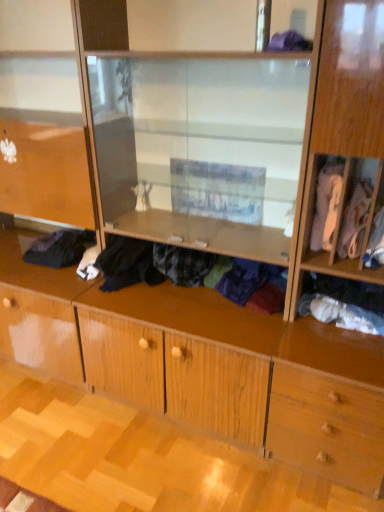
Locate an element on the screen. white fabric at right, which ranks as the fourth clothing in left-to-right order is located at coordinates (326, 205).

The image size is (384, 512). What do you see at coordinates (341, 314) in the screenshot?
I see `white fabric at lower right, which appears as the 2th clothing when viewed from the right` at bounding box center [341, 314].

In order to face purple fabric at upper center, the 5th clothing positioned from the right, should I rotate leftwards or rightwards?

To align with it, rotate right about 13.618°.

The width and height of the screenshot is (384, 512). In order to click on dark blue fabric at center, the second clothing in the left-to-right sequence in this screenshot , I will do `click(151, 264)`.

This screenshot has width=384, height=512. What do you see at coordinates (151, 264) in the screenshot?
I see `dark blue fabric at center, marked as the sixth clothing in a right-to-left arrangement` at bounding box center [151, 264].

What are the coordinates of `black fabric at lower left, positioned as the 7th clothing in right-to-left order` in the screenshot? It's located at (60, 248).

Is white fabric at lower right, which is counted as the 6th clothing, starting from the left, to the left or to the right of dark blue fabric at center, marked as the sixth clothing in a right-to-left arrangement, in the image?

Clearly, white fabric at lower right, which is counted as the 6th clothing, starting from the left, is on the right of dark blue fabric at center, marked as the sixth clothing in a right-to-left arrangement, in the image.

Where is `the 2nd clothing located above the white fabric at lower right, which appears as the 2th clothing when viewed from the right (from a real-world perspective)`? This screenshot has width=384, height=512. the 2nd clothing located above the white fabric at lower right, which appears as the 2th clothing when viewed from the right (from a real-world perspective) is located at coordinates (151, 264).

Considering the sizes of objects white fabric at lower right, which appears as the 2th clothing when viewed from the right, and dark blue fabric at center, marked as the sixth clothing in a right-to-left arrangement, in the image provided, who is smaller, white fabric at lower right, which appears as the 2th clothing when viewed from the right, or dark blue fabric at center, marked as the sixth clothing in a right-to-left arrangement,?

Smaller between the two is white fabric at lower right, which appears as the 2th clothing when viewed from the right.

From the image's perspective, is white fabric at lower right, which appears as the 2th clothing when viewed from the right, above or below dark blue fabric at center, marked as the sixth clothing in a right-to-left arrangement?

Clearly, from the image's perspective, white fabric at lower right, which appears as the 2th clothing when viewed from the right, is below dark blue fabric at center, marked as the sixth clothing in a right-to-left arrangement.

From the image's perspective, which one is positioned higher, white fabric at right, acting as the third clothing starting from the right, or black fabric at lower left, which appears as the 1th clothing when viewed from the left?

white fabric at right, acting as the third clothing starting from the right, from the image's perspective.

Is white fabric at right, acting as the third clothing starting from the right, thinner than black fabric at lower left, positioned as the 7th clothing in right-to-left order?

Correct, the width of white fabric at right, acting as the third clothing starting from the right, is less than that of black fabric at lower left, positioned as the 7th clothing in right-to-left order.

Are white fabric at right, acting as the third clothing starting from the right, and black fabric at lower left, positioned as the 7th clothing in right-to-left order, located far from each other?

That's right, there is a large distance between white fabric at right, acting as the third clothing starting from the right, and black fabric at lower left, positioned as the 7th clothing in right-to-left order.

From the image's perspective, which clothing is the 2nd one below the white fabric at right, which is the fifth clothing from left to right? Please provide its 2D coordinates.

[(60, 248)]

From a real-world perspective, does black fabric at lower left, which appears as the 1th clothing when viewed from the left, sit lower than purple fabric at upper center, which appears as the 3th clothing when viewed from the left?

Indeed, from a real-world perspective, black fabric at lower left, which appears as the 1th clothing when viewed from the left, is positioned beneath purple fabric at upper center, which appears as the 3th clothing when viewed from the left.

Considering the sizes of black fabric at lower left, positioned as the 7th clothing in right-to-left order, and purple fabric at upper center, which appears as the 3th clothing when viewed from the left, in the image, is black fabric at lower left, positioned as the 7th clothing in right-to-left order, taller or shorter than purple fabric at upper center, which appears as the 3th clothing when viewed from the left,?

Clearly, black fabric at lower left, positioned as the 7th clothing in right-to-left order, is taller compared to purple fabric at upper center, which appears as the 3th clothing when viewed from the left.

Looking at this image, is black fabric at lower left, positioned as the 7th clothing in right-to-left order, at the left side of purple fabric at upper center, which appears as the 3th clothing when viewed from the left?

Correct, you'll find black fabric at lower left, positioned as the 7th clothing in right-to-left order, to the left of purple fabric at upper center, which appears as the 3th clothing when viewed from the left.

Can you confirm if black fabric at lower left, positioned as the 7th clothing in right-to-left order, is thinner than purple fabric at upper center, the 5th clothing positioned from the right?

No.

Is dark blue fabric at center, marked as the sixth clothing in a right-to-left arrangement, inside or outside of white fabric at lower right, which is counted as the 6th clothing, starting from the left?

dark blue fabric at center, marked as the sixth clothing in a right-to-left arrangement, is not inside white fabric at lower right, which is counted as the 6th clothing, starting from the left, it's outside.

Is dark blue fabric at center, marked as the sixth clothing in a right-to-left arrangement, thinner than white fabric at lower right, which appears as the 2th clothing when viewed from the right?

Incorrect, the width of dark blue fabric at center, marked as the sixth clothing in a right-to-left arrangement, is not less than that of white fabric at lower right, which appears as the 2th clothing when viewed from the right.

Consider the image. Considering the relative sizes of dark blue fabric at center, marked as the sixth clothing in a right-to-left arrangement, and white fabric at lower right, which appears as the 2th clothing when viewed from the right, in the image provided, is dark blue fabric at center, marked as the sixth clothing in a right-to-left arrangement, shorter than white fabric at lower right, which appears as the 2th clothing when viewed from the right,?

Incorrect, the height of dark blue fabric at center, marked as the sixth clothing in a right-to-left arrangement, does not fall short of that of white fabric at lower right, which appears as the 2th clothing when viewed from the right.

Considering the relative positions of dark blue fabric at center, the second clothing in the left-to-right sequence, and white fabric at lower right, which is counted as the 6th clothing, starting from the left, in the image provided, is dark blue fabric at center, the second clothing in the left-to-right sequence, to the left or to the right of white fabric at lower right, which is counted as the 6th clothing, starting from the left,?

dark blue fabric at center, the second clothing in the left-to-right sequence, is positioned on white fabric at lower right, which is counted as the 6th clothing, starting from the left,'s left side.

Is white fabric at right, which is the fifth clothing from left to right, taller or shorter than white fabric at right, which ranks as the fourth clothing in left-to-right order?

Clearly, white fabric at right, which is the fifth clothing from left to right, is shorter compared to white fabric at right, which ranks as the fourth clothing in left-to-right order.

Is white fabric at right, acting as the third clothing starting from the right, directly adjacent to white fabric at right, which ranks as the fourth clothing in left-to-right order?

Yes.

What's the angular difference between white fabric at right, which is the fifth clothing from left to right, and white fabric at right, the 4th clothing from the right,'s facing directions?

0.000147 degrees.

Would you say white fabric at right, which is the fifth clothing from left to right, contains white fabric at right, the 4th clothing from the right?

No, white fabric at right, the 4th clothing from the right, is located outside of white fabric at right, which is the fifth clothing from left to right.

Who is bigger, dark blue fabric at center, marked as the sixth clothing in a right-to-left arrangement, or purple fabric at upper center, which appears as the 3th clothing when viewed from the left?

Bigger between the two is dark blue fabric at center, marked as the sixth clothing in a right-to-left arrangement.

Measure the distance between dark blue fabric at center, marked as the sixth clothing in a right-to-left arrangement, and purple fabric at upper center, the 5th clothing positioned from the right.

dark blue fabric at center, marked as the sixth clothing in a right-to-left arrangement, and purple fabric at upper center, the 5th clothing positioned from the right, are 38.52 inches apart from each other.

Consider the image. Is dark blue fabric at center, marked as the sixth clothing in a right-to-left arrangement, far away from purple fabric at upper center, the 5th clothing positioned from the right?

No.

Is dark blue fabric at center, the second clothing in the left-to-right sequence, behind purple fabric at upper center, the 5th clothing positioned from the right?

Yes, it is.

Does white fabric at right, which ranks as the fourth clothing in left-to-right order, turn towards dark blue fabric at center, the second clothing in the left-to-right sequence?

No, white fabric at right, which ranks as the fourth clothing in left-to-right order, does not turn towards dark blue fabric at center, the second clothing in the left-to-right sequence.

Does white fabric at right, the 4th clothing from the right, have a smaller size compared to dark blue fabric at center, the second clothing in the left-to-right sequence?

Yes.

Based on the photo, is white fabric at right, which ranks as the fourth clothing in left-to-right order, with dark blue fabric at center, marked as the sixth clothing in a right-to-left arrangement?

Answer: There is a gap between white fabric at right, which ranks as the fourth clothing in left-to-right order, and dark blue fabric at center, marked as the sixth clothing in a right-to-left arrangement.

Which object is wider, white fabric at right, which ranks as the fourth clothing in left-to-right order, or dark blue fabric at center, marked as the sixth clothing in a right-to-left arrangement?

dark blue fabric at center, marked as the sixth clothing in a right-to-left arrangement.

The width and height of the screenshot is (384, 512). In order to click on clothing that is the 4th object to the left of the white fabric at lower right, which appears as the 2th clothing when viewed from the right, starting at the anchor in this screenshot , I will do `click(151, 264)`.

Where is `clothing that is the 3rd one when counting backward from the white fabric at right, which is the fifth clothing from left to right`? The width and height of the screenshot is (384, 512). clothing that is the 3rd one when counting backward from the white fabric at right, which is the fifth clothing from left to right is located at coordinates (60, 248).

From the picture: When comparing their distances from white cotton shirt at right, the first clothing positioned from the right, does black fabric at lower left, positioned as the 7th clothing in right-to-left order, or white fabric at right, the 4th clothing from the right, seem closer?

white fabric at right, the 4th clothing from the right, lies closer to white cotton shirt at right, the first clothing positioned from the right, than the other object.

Considering their positions, is white fabric at right, which is the fifth clothing from left to right, positioned further to dark blue fabric at center, the second clothing in the left-to-right sequence, than white fabric at right, which ranks as the fourth clothing in left-to-right order?

The object further to dark blue fabric at center, the second clothing in the left-to-right sequence, is white fabric at right, which is the fifth clothing from left to right.

Estimate the real-world distances between objects in this image. Which object is further from white cotton shirt at right, the seventh clothing from the left, white fabric at right, which ranks as the fourth clothing in left-to-right order, or white fabric at lower right, which is counted as the 6th clothing, starting from the left?

white fabric at lower right, which is counted as the 6th clothing, starting from the left, lies further to white cotton shirt at right, the seventh clothing from the left, than the other object.

Estimate the real-world distances between objects in this image. Which object is further from purple fabric at upper center, the 5th clothing positioned from the right, white fabric at right, which is the fifth clothing from left to right, or white fabric at right, which ranks as the fourth clothing in left-to-right order?

The object further to purple fabric at upper center, the 5th clothing positioned from the right, is white fabric at right, which is the fifth clothing from left to right.

When comparing their distances from white fabric at lower right, which is counted as the 6th clothing, starting from the left, does purple fabric at upper center, which appears as the 3th clothing when viewed from the left, or white fabric at right, acting as the third clothing starting from the right, seem further?

The object further to white fabric at lower right, which is counted as the 6th clothing, starting from the left, is purple fabric at upper center, which appears as the 3th clothing when viewed from the left.

Looking at the image, which one is located closer to white cotton shirt at right, the seventh clothing from the left, purple fabric at upper center, the 5th clothing positioned from the right, or black fabric at lower left, which appears as the 1th clothing when viewed from the left?

purple fabric at upper center, the 5th clothing positioned from the right, is positioned closer to the anchor white cotton shirt at right, the seventh clothing from the left.

From the image, which object appears to be farther from black fabric at lower left, positioned as the 7th clothing in right-to-left order, white fabric at right, the 4th clothing from the right, or white fabric at lower right, which is counted as the 6th clothing, starting from the left?

white fabric at lower right, which is counted as the 6th clothing, starting from the left, is further to black fabric at lower left, positioned as the 7th clothing in right-to-left order.

Which object lies nearer to the anchor point white cotton shirt at right, the seventh clothing from the left, white fabric at right, acting as the third clothing starting from the right, or purple fabric at upper center, which appears as the 3th clothing when viewed from the left?

The object closer to white cotton shirt at right, the seventh clothing from the left, is white fabric at right, acting as the third clothing starting from the right.

I want to click on clothing situated between black fabric at lower left, which appears as the 1th clothing when viewed from the left, and purple fabric at upper center, which appears as the 3th clothing when viewed from the left, from left to right, so click(x=151, y=264).

I want to click on clothing between purple fabric at upper center, which appears as the 3th clothing when viewed from the left, and white fabric at right, acting as the third clothing starting from the right, in the up-down direction, so coord(326,205).